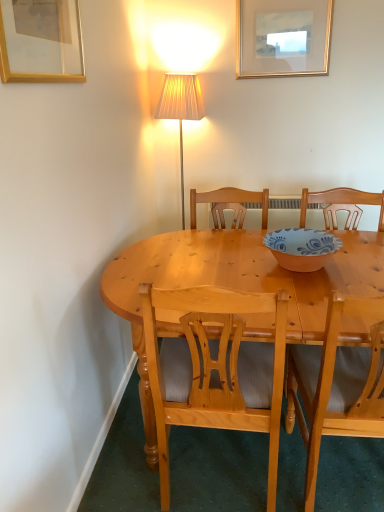
Question: Relative to gold/glass picture frame at upper left, which is counted as the first picture frame, starting from the bottom, is light wood chair at center, placed as the 1th chair when sorted from right to left, in front or behind?

Choices:
 (A) front
 (B) behind

Answer: (B)

Question: Is light wood chair at center, which ranks as the second chair in left-to-right order, to the left or to the right of gold/glass picture frame at upper left, acting as the 1th picture frame starting from the front, in the image?

Choices:
 (A) left
 (B) right

Answer: (B)

Question: Based on their relative distances, which object is nearer to the gold/glass picture frame at upper left, which is counted as the first picture frame, starting from the bottom?

Choices:
 (A) gold-framed picture at upper center, the first picture frame when ordered from right to left
 (B) blue and white ceramic bowl at center
 (C) light brown wooden chair at center, acting as the second chair starting from the right
 (D) light wood chair at center, which ranks as the second chair in left-to-right order

Answer: (C)

Question: Considering the real-world distances, which object is farthest from the light brown wooden chair at center, marked as the first chair in a left-to-right arrangement?

Choices:
 (A) light wood chair at center, placed as the 1th chair when sorted from right to left
 (B) blue and white ceramic bowl at center
 (C) gold/glass picture frame at upper left, the 1th picture frame viewed from the left
 (D) gold-framed picture at upper center, the first picture frame when ordered from right to left

Answer: (D)